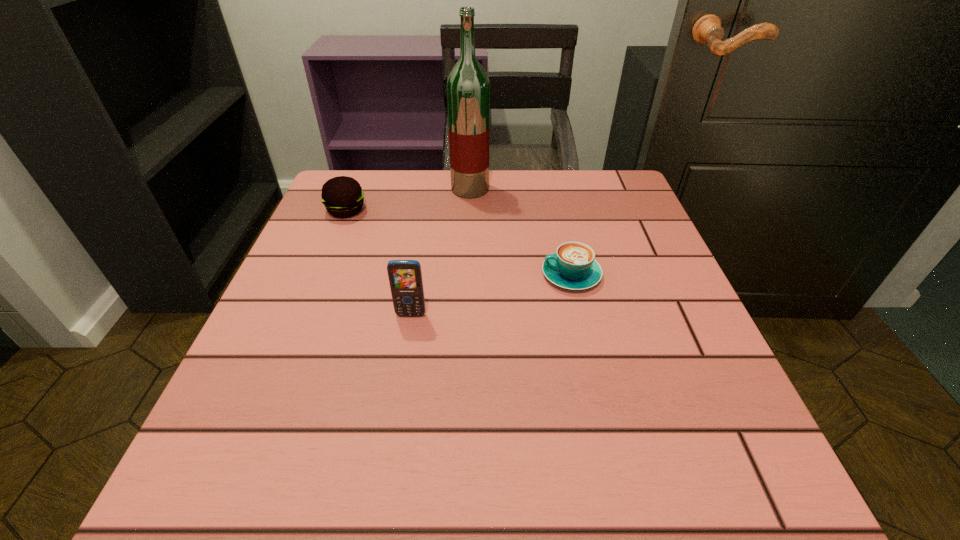
I want to click on the third object from left to right, so click(468, 87).

At what (x,y) coordinates should I click in order to perform the action: click on liquor. Please return your answer as a coordinate pair (x, y). This screenshot has height=540, width=960. Looking at the image, I should click on (468, 87).

This screenshot has width=960, height=540. I want to click on cellular telephone, so click(x=405, y=276).

The height and width of the screenshot is (540, 960). Identify the location of the nearest object. (405, 276).

Where is `patty`? patty is located at coordinates (343, 197).

This screenshot has width=960, height=540. I want to click on the third nearest object, so click(343, 197).

Find the location of a particular element. The image size is (960, 540). the third farthest object is located at coordinates (573, 266).

Find the location of a particular element. the rightmost object is located at coordinates (573, 266).

Find the location of `vacant space situated 0.110m on the left of the second object from right to left`. vacant space situated 0.110m on the left of the second object from right to left is located at coordinates (406, 189).

The height and width of the screenshot is (540, 960). In order to click on vacant space positioned 0.300m on the screen of the cellular telephone in this screenshot , I will do `click(381, 502)`.